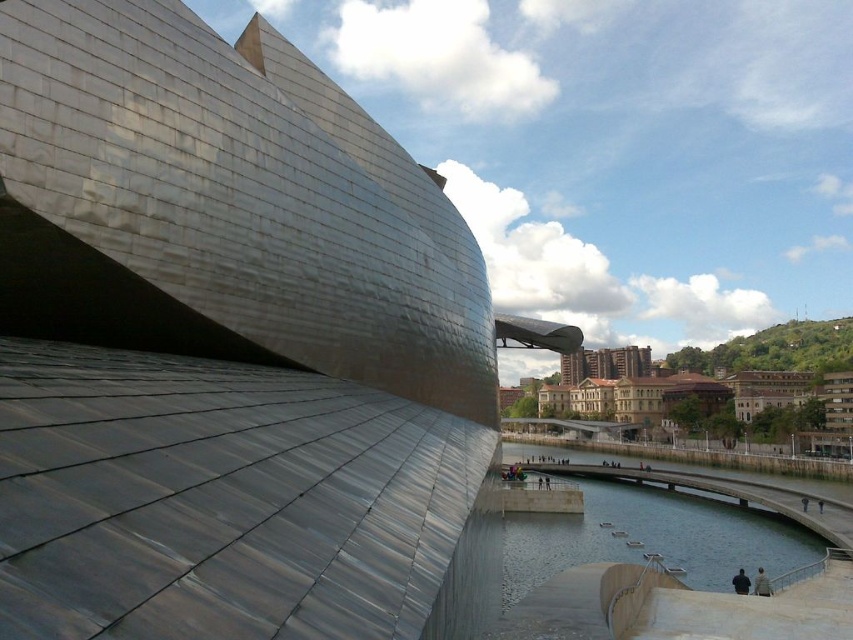
Question: In this image, where is clear water at lower center located relative to dark brown leather jacket at lower right?

Choices:
 (A) above
 (B) below

Answer: (B)

Question: Observing the image, what is the correct spatial positioning of clear water at lower center in reference to dark blue fabric jacket at lower right?

Choices:
 (A) left
 (B) right

Answer: (B)

Question: Estimate the real-world distances between objects in this image. Which object is farther from the metallic silver building at upper left?

Choices:
 (A) dark blue fabric jacket at lower right
 (B) clear water at lower center

Answer: (A)

Question: Which of the following is the farthest from the observer?

Choices:
 (A) (432, 292)
 (B) (747, 580)
 (C) (822, 540)
 (D) (757, 579)

Answer: (C)

Question: Which point appears closest to the camera in this image?

Choices:
 (A) (793, 522)
 (B) (759, 592)

Answer: (B)

Question: Does metallic silver building at upper left have a smaller size compared to dark brown leather jacket at lower right?

Choices:
 (A) no
 (B) yes

Answer: (A)